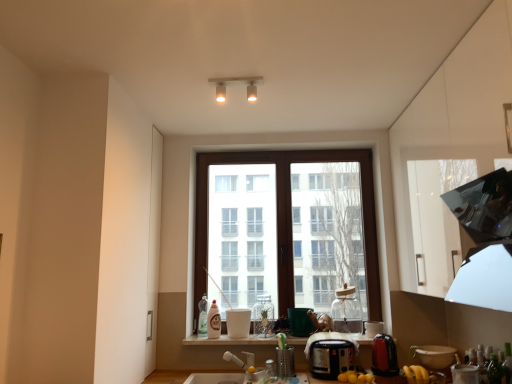
Identify the location of blank space situated above brown wooden window at center (from a real-world perspective). (303, 146).